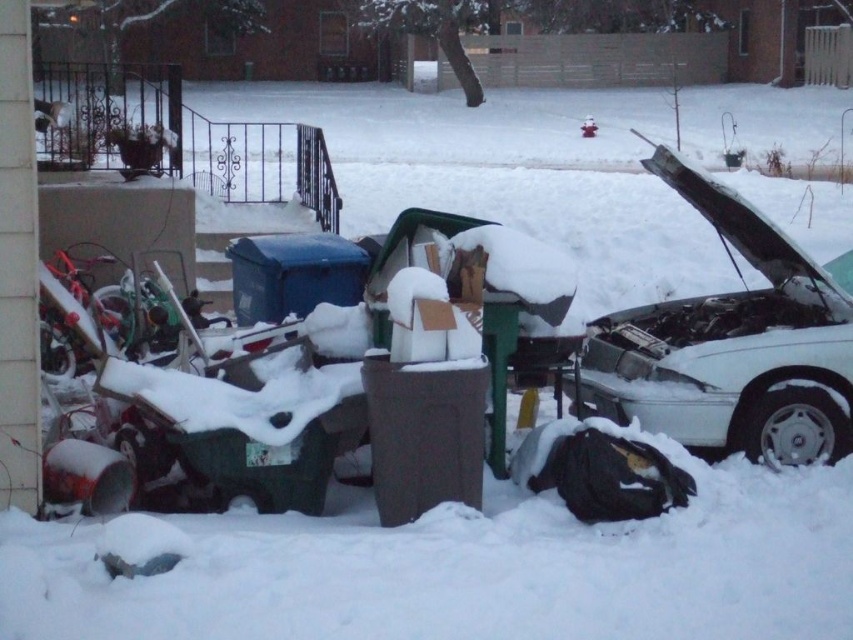
Question: Can you confirm if white matte car at right is positioned below blue plastic bin at center?

Choices:
 (A) no
 (B) yes

Answer: (B)

Question: Which point is farther from the camera taking this photo?

Choices:
 (A) (280, 268)
 (B) (415, 460)

Answer: (A)

Question: Among these objects, which one is nearest to the camera?

Choices:
 (A) white matte car at right
 (B) brown matte trash can at center

Answer: (B)

Question: In this image, where is white matte car at right located relative to brown matte trash can at center?

Choices:
 (A) right
 (B) left

Answer: (A)

Question: Is brown matte trash can at center positioned at the back of blue plastic bin at center?

Choices:
 (A) no
 (B) yes

Answer: (A)

Question: Based on their relative distances, which object is farther from the white matte car at right?

Choices:
 (A) blue plastic bin at center
 (B) brown matte trash can at center

Answer: (A)